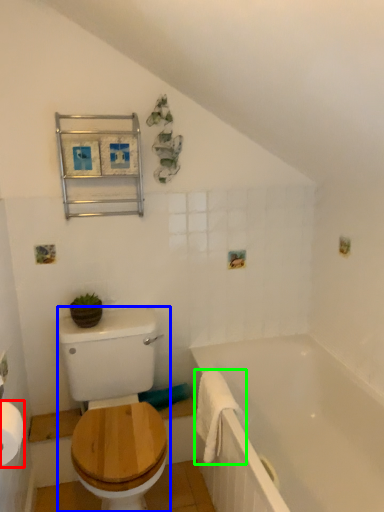
Question: Which is farther away from toilet paper (highlighted by a red box)? sit (highlighted by a blue box) or bath towel (highlighted by a green box)?

Choices:
 (A) sit
 (B) bath towel

Answer: (B)